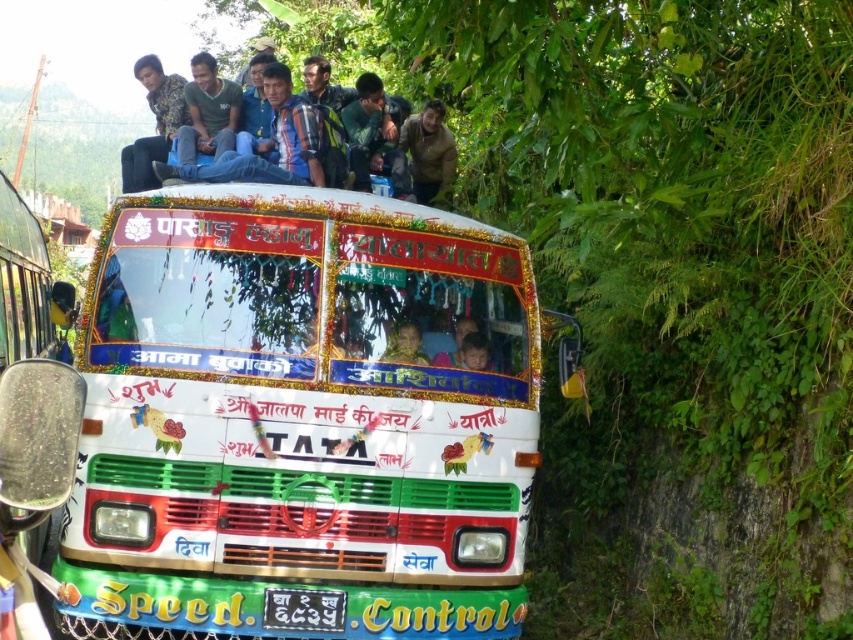
Which is behind, point (265, 70) or point (386, 346)?

Positioned behind is point (265, 70).

Is blue denim jeans at upper center in front of golden fabric headscarf at center?

No, blue denim jeans at upper center is behind golden fabric headscarf at center.

Who is more forward, (442, 140) or (415, 352)?

Point (415, 352)

Where is `blue denim jeans at upper center`? The width and height of the screenshot is (853, 640). blue denim jeans at upper center is located at coordinates (317, 145).

Is white glossy bus at center positioned behind matte blue jeans at upper center?

That is False.

Is white glossy bus at center to the right of matte blue jeans at upper center from the viewer's perspective?

Indeed, white glossy bus at center is positioned on the right side of matte blue jeans at upper center.

Locate an element on the screen. white glossy bus at center is located at coordinates [302, 419].

In the scene shown: Does white glossy bus at center appear on the left side of golden fabric headscarf at center?

Indeed, white glossy bus at center is positioned on the left side of golden fabric headscarf at center.

Is point (99, 314) less distant than point (395, 352)?

Yes, it is.

Identify the location of white glossy bus at center. (302, 419).